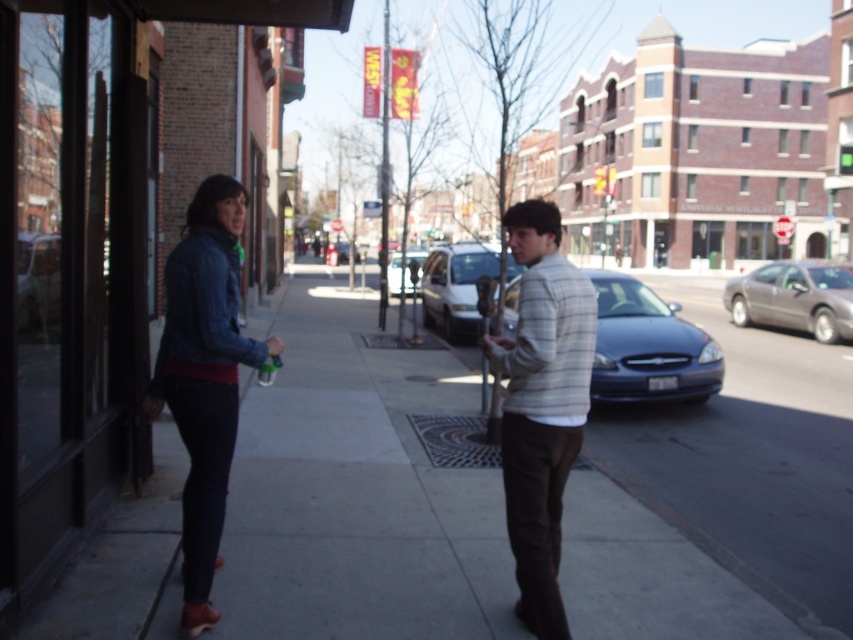
You are a pedestrian standing on the sidewalk. You see the denim jacket at left and the metallic silver sedan at center. Which object is nearer to you?

The denim jacket at left is closer to the viewer than the metallic silver sedan at center.

You are standing at the point marked by coordinates point (x=357, y=490) on the gray concrete sidewalk at center. Which direction should you walk to reach the woman in the denim jacket?

The gray concrete sidewalk at center is represented by point (x=357, y=490). Since the woman is on the left side of the image, you should walk towards the left to reach her.

You are standing at the point marked as point (x=541, y=404) in the image. What object is located at that point?

The point (x=541, y=404) corresponds to the striped cotton shirt at center.